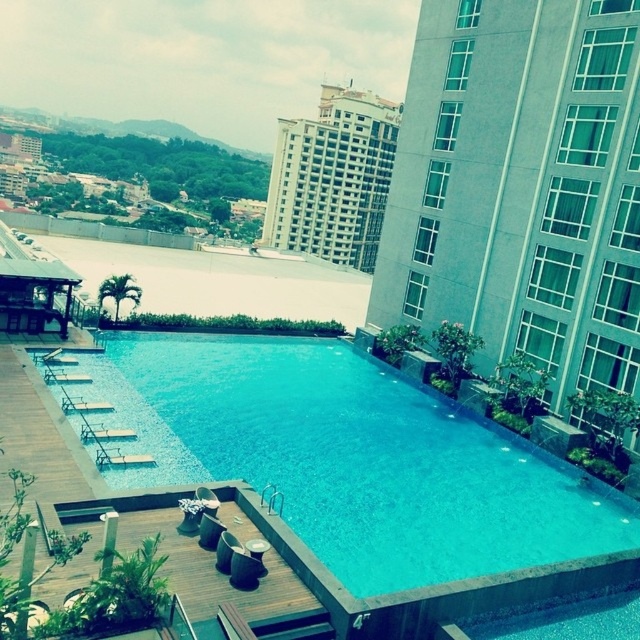
Question: Is blue tile swimming pool at center bigger than white glass building at upper right?

Choices:
 (A) yes
 (B) no

Answer: (B)

Question: Estimate the real-world distances between objects in this image. Which object is farther from the white glossy building at upper center?

Choices:
 (A) blue tile swimming pool at center
 (B) white glass building at upper right

Answer: (A)

Question: Where is blue tile swimming pool at center located in relation to white glossy building at upper center in the image?

Choices:
 (A) below
 (B) above

Answer: (A)

Question: Observing the image, what is the correct spatial positioning of blue tile swimming pool at center in reference to white glass building at upper right?

Choices:
 (A) right
 (B) left

Answer: (B)

Question: Which object is positioned closest to the white glass building at upper right?

Choices:
 (A) white glossy building at upper center
 (B) blue tile swimming pool at center

Answer: (B)

Question: Which object is the closest to the white glossy building at upper center?

Choices:
 (A) white glass building at upper right
 (B) blue tile swimming pool at center

Answer: (A)